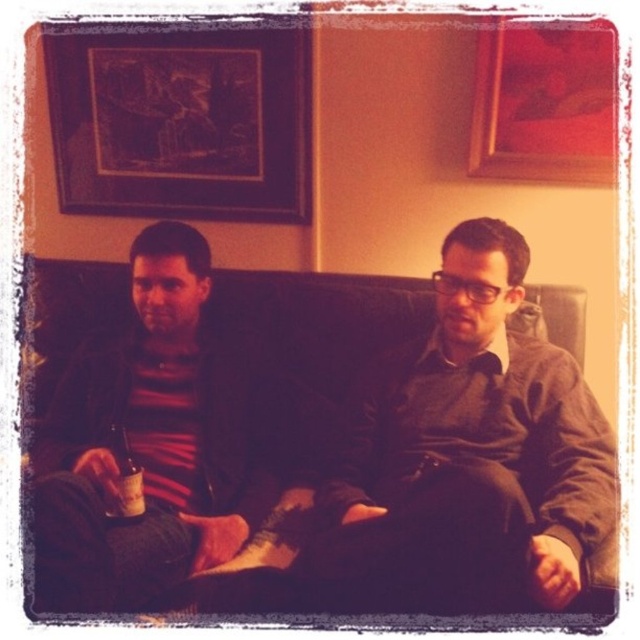
Question: Which point appears farthest from the camera in this image?

Choices:
 (A) (412, 420)
 (B) (118, 464)

Answer: (A)

Question: Which is farther from the striped sweater at left?

Choices:
 (A) amber glass bottle at lower left
 (B) wooden framed artwork at upper left

Answer: (B)

Question: Does matte red picture frame at upper right lie behind amber glass bottle at lower left?

Choices:
 (A) yes
 (B) no

Answer: (A)

Question: Estimate the real-world distances between objects in this image. Which object is closer to the black leather couch at center?

Choices:
 (A) wooden framed artwork at upper left
 (B) matte red picture frame at upper right
 (C) amber glass bottle at lower left
 (D) striped sweater at left

Answer: (D)

Question: Does wooden framed artwork at upper left appear on the left side of amber glass bottle at lower left?

Choices:
 (A) no
 (B) yes

Answer: (B)

Question: From the image, what is the correct spatial relationship of black leather couch at center in relation to amber glass bottle at lower left?

Choices:
 (A) below
 (B) above

Answer: (B)